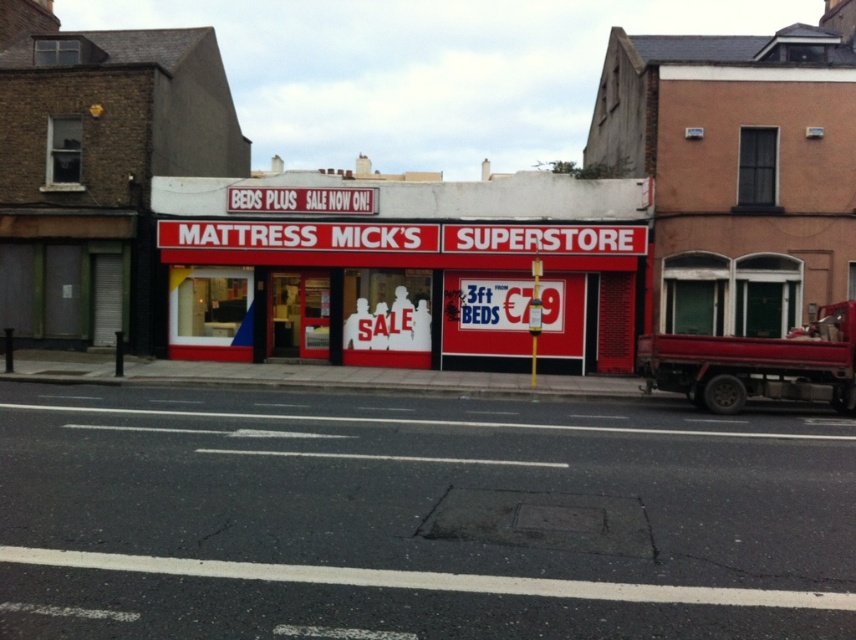
You are a customer standing in front of the store. You see the red matte sign at center and the metallic red truck at right. Which object is wider from your perspective?

The red matte sign at center is wider than the metallic red truck at right.